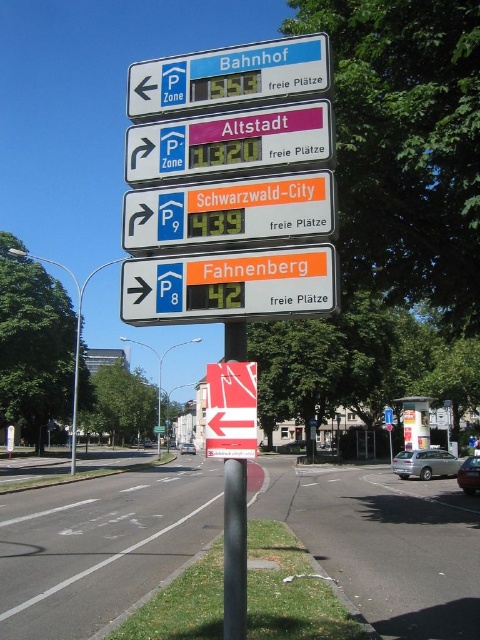
Question: Can you confirm if orange plastic parking sign at lower center is smaller than metallic pole at center?

Choices:
 (A) yes
 (B) no

Answer: (A)

Question: Does orange plastic sign at center lie in front of pink fabric altstadt at upper center?

Choices:
 (A) yes
 (B) no

Answer: (A)

Question: Which object appears farthest from the camera in this image?

Choices:
 (A) blue plastic sign at upper left
 (B) orange plastic parking sign at lower center
 (C) pink fabric altstadt at upper center

Answer: (A)

Question: Based on their relative distances, which object is nearer to the pink fabric altstadt at upper center?

Choices:
 (A) orange plastic sign at center
 (B) blue plastic sign at upper left
 (C) metallic pole at center

Answer: (A)

Question: Considering the real-world distances, which object is closest to the blue plastic sign at upper left?

Choices:
 (A) orange plastic sign at center
 (B) pink fabric altstadt at upper center
 (C) orange plastic parking sign at lower center

Answer: (A)

Question: From the image, what is the correct spatial relationship of orange plastic parking sign at lower center in relation to orange plastic sign at center?

Choices:
 (A) below
 (B) above

Answer: (A)